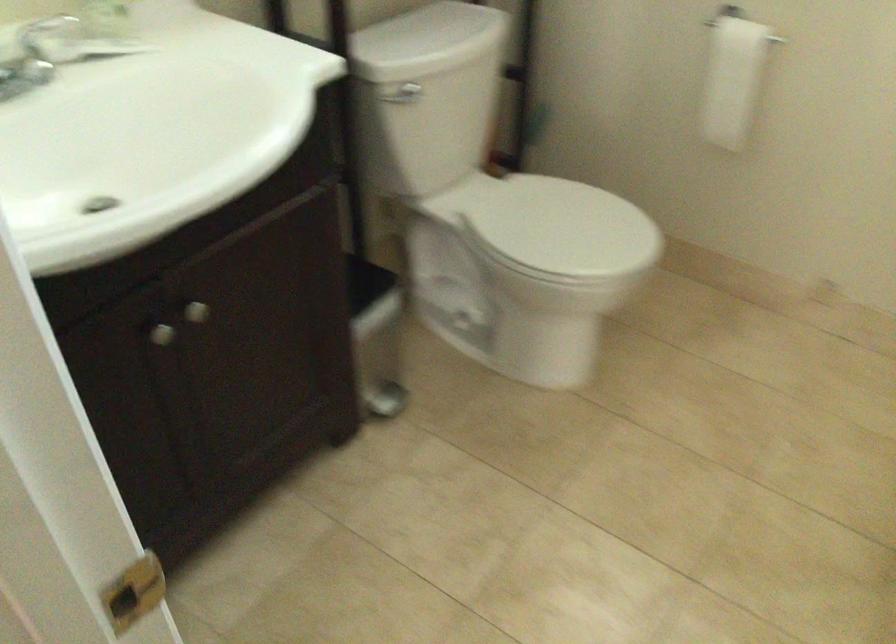
The image size is (896, 644). Describe the element at coordinates (376, 336) in the screenshot. I see `a trash can pedal` at that location.